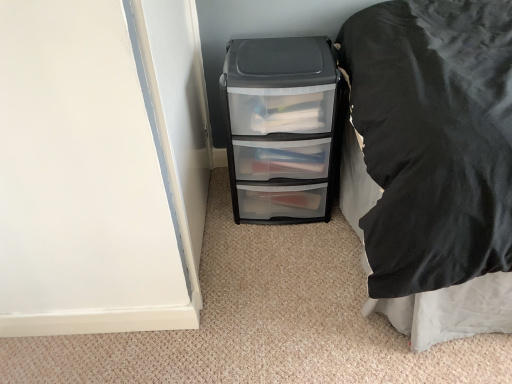
You are a GUI agent. You are given a task and a screenshot of the screen. Output one action in this format:
    pyautogui.click(x=<x>, y=<y>)
    Task: Click on the clear plastic drawer unit at lower right
    This screenshot has height=384, width=512.
    Given the screenshot: What is the action you would take?
    pos(433,162)

Describe the element at coordinates (433, 162) in the screenshot. I see `clear plastic drawer unit at lower right` at that location.

Image resolution: width=512 pixels, height=384 pixels. In order to click on transparent plastic file cabinet at center in this screenshot , I will do `click(282, 128)`.

Describe the element at coordinates (282, 128) in the screenshot. I see `transparent plastic file cabinet at center` at that location.

Measure the distance between point (319, 60) and camera.

A distance of 1.35 meters exists between point (319, 60) and camera.

Where is `clear plastic drawer unit at lower right`? clear plastic drawer unit at lower right is located at coordinates coord(433,162).

Considering the relative positions of transparent plastic file cabinet at center and clear plastic drawer unit at lower right in the image provided, is transparent plastic file cabinet at center to the left or to the right of clear plastic drawer unit at lower right?

Based on their positions, transparent plastic file cabinet at center is located to the left of clear plastic drawer unit at lower right.

Does transparent plastic file cabinet at center lie in front of clear plastic drawer unit at lower right?

No, the depth of transparent plastic file cabinet at center is greater than that of clear plastic drawer unit at lower right.

Between point (283, 222) and point (457, 237), which one is positioned in front?

The point (457, 237) is in front.

From the image's perspective, would you say transparent plastic file cabinet at center is positioned over clear plastic drawer unit at lower right?

Yes.

From a real-world perspective, who is located higher, transparent plastic file cabinet at center or clear plastic drawer unit at lower right?

In real-world perspective, clear plastic drawer unit at lower right is above.

Considering the sizes of objects transparent plastic file cabinet at center and clear plastic drawer unit at lower right in the image provided, who is wider, transparent plastic file cabinet at center or clear plastic drawer unit at lower right?

Wider between the two is clear plastic drawer unit at lower right.

Can you confirm if transparent plastic file cabinet at center is taller than clear plastic drawer unit at lower right?

Incorrect, the height of transparent plastic file cabinet at center is not larger of that of clear plastic drawer unit at lower right.

Can you confirm if transparent plastic file cabinet at center is smaller than clear plastic drawer unit at lower right?

Correct, transparent plastic file cabinet at center occupies less space than clear plastic drawer unit at lower right.

Is transparent plastic file cabinet at center completely or partially outside of clear plastic drawer unit at lower right?

Yes.

Is transparent plastic file cabinet at center directly adjacent to clear plastic drawer unit at lower right?

No, transparent plastic file cabinet at center is not making contact with clear plastic drawer unit at lower right.

Could you tell me if transparent plastic file cabinet at center is turned towards clear plastic drawer unit at lower right?

No, transparent plastic file cabinet at center is not oriented towards clear plastic drawer unit at lower right.

What's the angular difference between transparent plastic file cabinet at center and clear plastic drawer unit at lower right's facing directions?

They differ by 87.1 degrees in their facing directions.

The image size is (512, 384). I want to click on file cabinet below the clear plastic drawer unit at lower right (from a real-world perspective), so click(282, 128).

Looking at this image, considering the positions of objects clear plastic drawer unit at lower right and transparent plastic file cabinet at center in the image provided, who is more to the right, clear plastic drawer unit at lower right or transparent plastic file cabinet at center?

clear plastic drawer unit at lower right.

Looking at this image, is clear plastic drawer unit at lower right in front of or behind transparent plastic file cabinet at center in the image?

Clearly, clear plastic drawer unit at lower right is in front of transparent plastic file cabinet at center.

Which is closer to the camera, (x=446, y=273) or (x=277, y=94)?

Point (x=446, y=273).

From the image's perspective, is clear plastic drawer unit at lower right located above transparent plastic file cabinet at center?

Actually, clear plastic drawer unit at lower right appears below transparent plastic file cabinet at center in the image.

From a real-world perspective, is clear plastic drawer unit at lower right below transparent plastic file cabinet at center?

No, from a real-world perspective, clear plastic drawer unit at lower right is not under transparent plastic file cabinet at center.

Can you confirm if clear plastic drawer unit at lower right is wider than transparent plastic file cabinet at center?

Yes, clear plastic drawer unit at lower right is wider than transparent plastic file cabinet at center.

Who is shorter, clear plastic drawer unit at lower right or transparent plastic file cabinet at center?

With less height is transparent plastic file cabinet at center.

Consider the image. Based on their sizes in the image, would you say clear plastic drawer unit at lower right is bigger or smaller than transparent plastic file cabinet at center?

In the image, clear plastic drawer unit at lower right appears to be larger than transparent plastic file cabinet at center.

Is clear plastic drawer unit at lower right inside the boundaries of transparent plastic file cabinet at center, or outside?

clear plastic drawer unit at lower right is outside transparent plastic file cabinet at center.

Is clear plastic drawer unit at lower right far away from transparent plastic file cabinet at center?

No, clear plastic drawer unit at lower right is not far away from transparent plastic file cabinet at center.

Is clear plastic drawer unit at lower right oriented away from transparent plastic file cabinet at center?

No, transparent plastic file cabinet at center is not at the back of clear plastic drawer unit at lower right.

Could you measure the distance between clear plastic drawer unit at lower right and transparent plastic file cabinet at center?

The distance of clear plastic drawer unit at lower right from transparent plastic file cabinet at center is 15.08 inches.

At what (x,y) coordinates should I click in order to perform the action: click on furniture above the transparent plastic file cabinet at center (from a real-world perspective). Please return your answer as a coordinate pair (x, y). The width and height of the screenshot is (512, 384). Looking at the image, I should click on (433, 162).

Locate an element on the screen. The width and height of the screenshot is (512, 384). file cabinet lying above the clear plastic drawer unit at lower right (from the image's perspective) is located at coordinates (282, 128).

Find the location of a particular element. This screenshot has width=512, height=384. file cabinet below the clear plastic drawer unit at lower right (from a real-world perspective) is located at coordinates (282, 128).